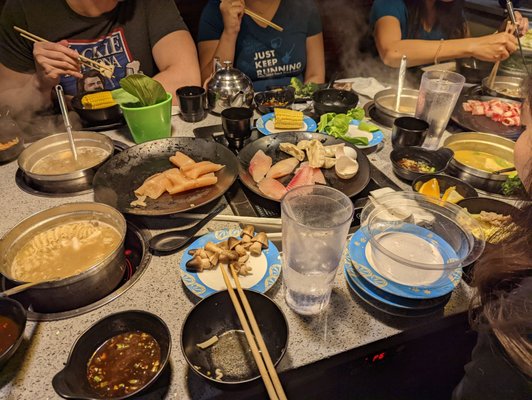
Locate an element on the screen. This screenshot has height=400, width=532. chopsticks is located at coordinates (237, 309), (246, 301), (89, 59), (89, 65), (259, 17), (494, 68).